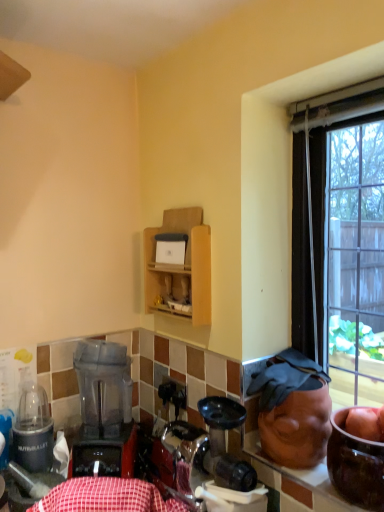
Question: Does red checkered tablecloth at lower center have a lesser width compared to metallic silver blender at left?

Choices:
 (A) no
 (B) yes

Answer: (A)

Question: Is red checkered tablecloth at lower center to the right of metallic silver blender at left from the viewer's perspective?

Choices:
 (A) yes
 (B) no

Answer: (A)

Question: Does red checkered tablecloth at lower center turn towards metallic silver blender at left?

Choices:
 (A) yes
 (B) no

Answer: (B)

Question: Are red checkered tablecloth at lower center and metallic silver blender at left making contact?

Choices:
 (A) yes
 (B) no

Answer: (B)

Question: Is red checkered tablecloth at lower center further to camera compared to metallic silver blender at left?

Choices:
 (A) no
 (B) yes

Answer: (A)

Question: Considering the positions of red checkered tablecloth at lower center and wooden cabinet at upper center in the image, is red checkered tablecloth at lower center taller or shorter than wooden cabinet at upper center?

Choices:
 (A) tall
 (B) short

Answer: (B)

Question: From the image's perspective, is red checkered tablecloth at lower center located above or below wooden cabinet at upper center?

Choices:
 (A) below
 (B) above

Answer: (A)

Question: From a real-world perspective, relative to wooden cabinet at upper center, is red checkered tablecloth at lower center vertically above or below?

Choices:
 (A) above
 (B) below

Answer: (B)

Question: Is red checkered tablecloth at lower center inside or outside of wooden cabinet at upper center?

Choices:
 (A) inside
 (B) outside

Answer: (B)

Question: Considering the positions of point (105, 410) and point (31, 434), is point (105, 410) closer or farther from the camera than point (31, 434)?

Choices:
 (A) farther
 (B) closer

Answer: (B)

Question: From the image's perspective, relative to metallic silver blender at left, is translucent plastic blender at lower left above or below?

Choices:
 (A) below
 (B) above

Answer: (B)

Question: From a real-world perspective, is translucent plastic blender at lower left above or below metallic silver blender at left?

Choices:
 (A) above
 (B) below

Answer: (A)

Question: Based on their sizes in the image, would you say translucent plastic blender at lower left is bigger or smaller than metallic silver blender at left?

Choices:
 (A) big
 (B) small

Answer: (A)

Question: Considering their positions, is wooden cabinet at upper center located in front of or behind translucent plastic blender at lower left?

Choices:
 (A) front
 (B) behind

Answer: (B)

Question: Considering the positions of point (192, 270) and point (89, 462), is point (192, 270) closer or farther from the camera than point (89, 462)?

Choices:
 (A) closer
 (B) farther

Answer: (B)